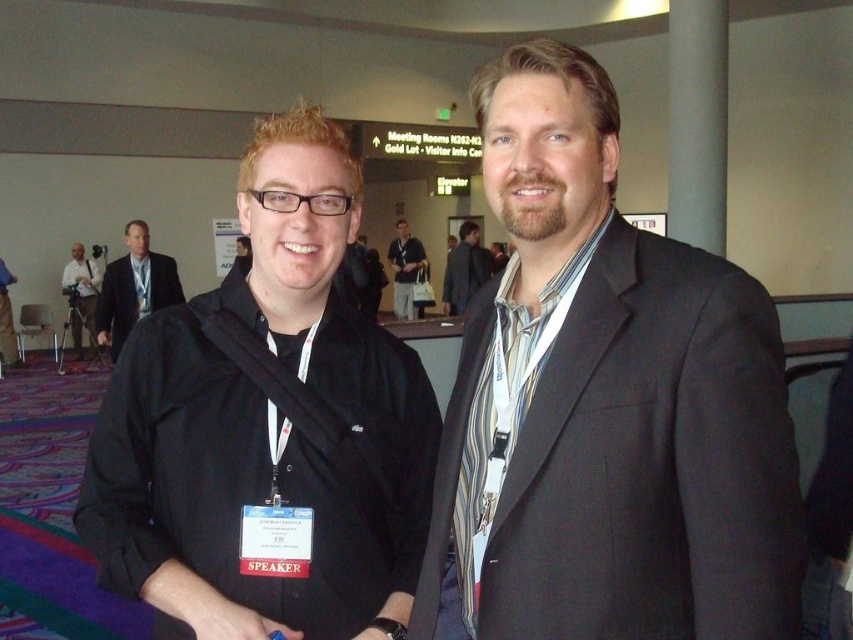
Question: Can you confirm if matte black suit at center is thinner than black matte jacket at left?

Choices:
 (A) yes
 (B) no

Answer: (A)

Question: Which of the following is the closest to the observer?

Choices:
 (A) (71, 280)
 (B) (0, 323)

Answer: (B)

Question: Considering the real-world distances, which object is farthest from the black matte jacket at center?

Choices:
 (A) matte black suit at center
 (B) matte black jacket at center

Answer: (A)

Question: Which object appears farthest from the camera in this image?

Choices:
 (A) matte black camera at left
 (B) matte black jacket at center
 (C) matte black suit at center
 (D) black matte jacket at left

Answer: (B)

Question: Is matte black suit at center thinner than black matte jacket at left?

Choices:
 (A) yes
 (B) no

Answer: (A)

Question: Is black matte jacket at left positioned in front of black matte jacket at center?

Choices:
 (A) no
 (B) yes

Answer: (B)